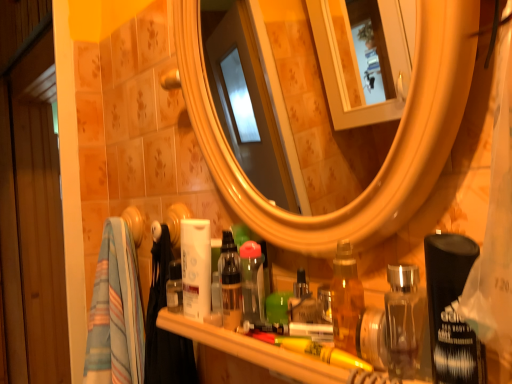
Question: Is the position of translucent plastic bottle at center, arranged as the 1th toiletry when viewed from the left, less distant than that of translucent plastic items at lower center?

Choices:
 (A) no
 (B) yes

Answer: (A)

Question: From a real-world perspective, is translucent plastic bottle at center, arranged as the 1th toiletry when viewed from the left, on translucent plastic items at lower center?

Choices:
 (A) no
 (B) yes

Answer: (B)

Question: Is translucent plastic bottle at center, arranged as the 1th toiletry when viewed from the left, taller than translucent plastic items at lower center?

Choices:
 (A) no
 (B) yes

Answer: (B)

Question: Is translucent plastic bottle at center, arranged as the 1th toiletry when viewed from the left, looking in the opposite direction of translucent plastic items at lower center?

Choices:
 (A) yes
 (B) no

Answer: (B)

Question: Is translucent plastic bottle at center, which appears as the third toiletry when viewed from the right, to the left of translucent plastic items at lower center from the viewer's perspective?

Choices:
 (A) yes
 (B) no

Answer: (A)

Question: Considering the positions of translucent plastic bottle at center, which appears as the third toiletry when viewed from the right, and clear plastic bottle at center, which appears as the 2th toiletry when viewed from the left, in the image, is translucent plastic bottle at center, which appears as the third toiletry when viewed from the right, wider or thinner than clear plastic bottle at center, which appears as the 2th toiletry when viewed from the left,?

Choices:
 (A) wide
 (B) thin

Answer: (B)

Question: From a real-world perspective, is translucent plastic bottle at center, arranged as the 1th toiletry when viewed from the left, physically located above or below clear plastic bottle at center, the 2th toiletry when ordered from right to left?

Choices:
 (A) above
 (B) below

Answer: (B)

Question: In terms of size, does translucent plastic bottle at center, which appears as the third toiletry when viewed from the right, appear bigger or smaller than clear plastic bottle at center, the 2th toiletry when ordered from right to left?

Choices:
 (A) small
 (B) big

Answer: (A)

Question: Is point (225, 258) positioned closer to the camera than point (256, 296)?

Choices:
 (A) closer
 (B) farther

Answer: (B)

Question: Is translucent plastic items at lower center wider or thinner than clear plastic bottle at center, which appears as the 2th toiletry when viewed from the left?

Choices:
 (A) thin
 (B) wide

Answer: (B)

Question: Based on their sizes in the image, would you say translucent plastic items at lower center is bigger or smaller than clear plastic bottle at center, which appears as the 2th toiletry when viewed from the left?

Choices:
 (A) big
 (B) small

Answer: (A)

Question: In the image, is translucent plastic items at lower center on the left side or the right side of clear plastic bottle at center, which appears as the 2th toiletry when viewed from the left?

Choices:
 (A) left
 (B) right

Answer: (B)

Question: Is point click(315, 369) positioned closer to the camera than point click(252, 291)?

Choices:
 (A) farther
 (B) closer

Answer: (B)

Question: Considering the positions of green plastic brush at center, the third toiletry positioned from the left, and clear plastic bottle at center, which appears as the 2th toiletry when viewed from the left, in the image, is green plastic brush at center, the third toiletry positioned from the left, taller or shorter than clear plastic bottle at center, which appears as the 2th toiletry when viewed from the left,?

Choices:
 (A) short
 (B) tall

Answer: (A)

Question: From a real-world perspective, is green plastic brush at center, the third toiletry positioned from the left, positioned above or below clear plastic bottle at center, which appears as the 2th toiletry when viewed from the left?

Choices:
 (A) above
 (B) below

Answer: (B)